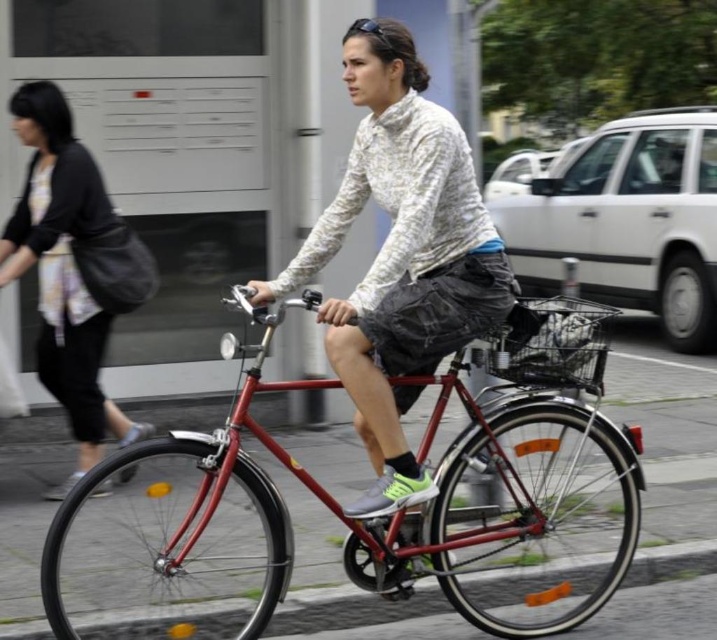
Question: Is white textured shirt at center smaller than matte black jacket at left?

Choices:
 (A) no
 (B) yes

Answer: (A)

Question: Which point is closer to the camera?

Choices:
 (A) (417, 390)
 (B) (65, 362)

Answer: (A)

Question: Can you confirm if metallic red bicycle at center is bigger than matte black jacket at left?

Choices:
 (A) no
 (B) yes

Answer: (B)

Question: Which point appears closest to the camera in this image?

Choices:
 (A) (374, 163)
 (B) (285, 385)
 (C) (133, 438)

Answer: (B)

Question: Which point is farther to the camera?

Choices:
 (A) metallic red bicycle at center
 (B) matte black jacket at left

Answer: (B)

Question: Does metallic red bicycle at center appear over white textured shirt at center?

Choices:
 (A) no
 (B) yes

Answer: (A)